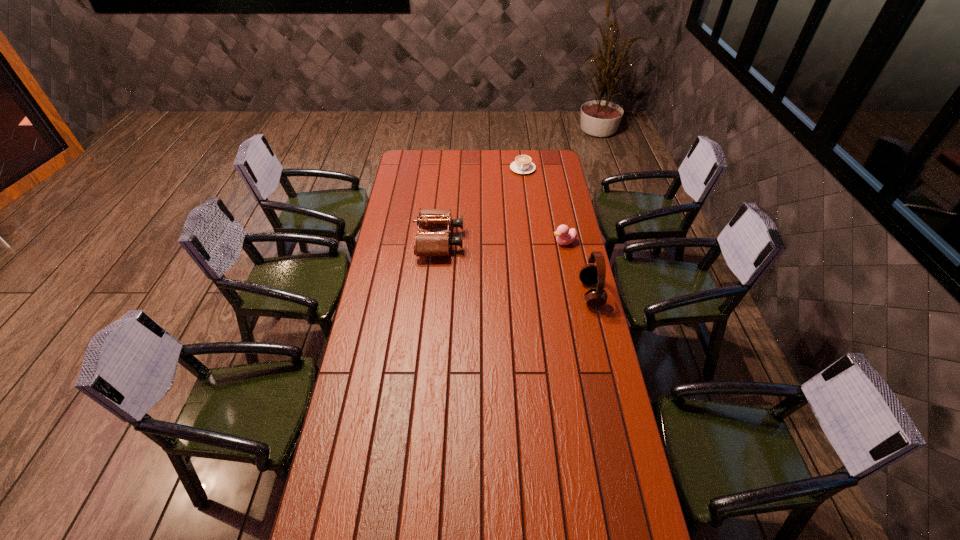
Find the location of a particular element. The image size is (960, 540). free point between the farthest object and the duckling is located at coordinates (543, 205).

Find the location of `vacant space in between the shortest object and the binoculars`. vacant space in between the shortest object and the binoculars is located at coordinates (481, 205).

Find the location of `free spot between the farthest object and the second shortest object`. free spot between the farthest object and the second shortest object is located at coordinates (543, 205).

Find the location of a particular element. empty space between the binoculars and the tallest object is located at coordinates (516, 267).

In order to click on free spot between the second object from left to right and the third tallest object in this screenshot , I will do `click(543, 205)`.

Identify the location of vacant region between the duckling and the third object from right to left. Image resolution: width=960 pixels, height=540 pixels. (543, 205).

At what (x,y) coordinates should I click in order to perform the action: click on blank region between the duckling and the leftmost object. Please return your answer as a coordinate pair (x, y). This screenshot has height=540, width=960. Looking at the image, I should click on (502, 242).

Choose which object is the second nearest neighbor to the third object from right to left. Please provide its 2D coordinates. Your answer should be formatted as a tuple, i.e. [(x, y)], where the tuple contains the x and y coordinates of a point satisfying the conditions above.

[(564, 236)]

Identify which object is located as the third nearest to the second tallest object. Please provide its 2D coordinates. Your answer should be formatted as a tuple, i.e. [(x, y)], where the tuple contains the x and y coordinates of a point satisfying the conditions above.

[(590, 274)]

The height and width of the screenshot is (540, 960). Identify the location of free space in the image that satisfies the following two spatial constraints: 1. on the front side of the tallest object; 2. on the ear pads of the duckling. (574, 293).